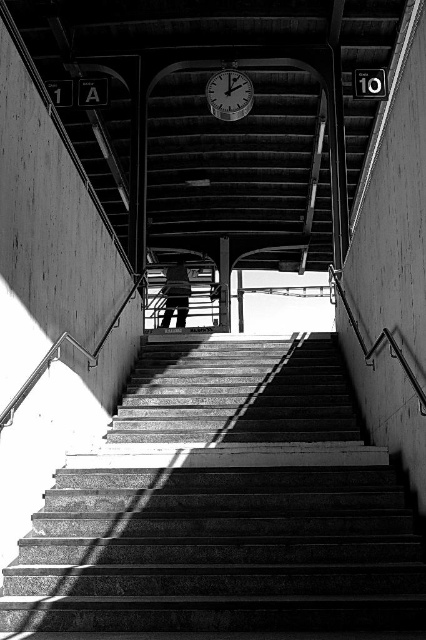
Does metallic clock at center have a lesser height compared to smooth concrete pillar at center?

Yes, metallic clock at center is shorter than smooth concrete pillar at center.

Can you confirm if metallic clock at center is positioned below smooth concrete pillar at center?

No.

Between point (230, 72) and point (227, 272), which one is positioned behind?

Point (227, 272)

The width and height of the screenshot is (426, 640). I want to click on metallic clock at center, so click(x=229, y=93).

Does metallic clock at center appear on the right side of metallic silver skateboard at center?

Correct, you'll find metallic clock at center to the right of metallic silver skateboard at center.

Is metallic clock at center below metallic silver skateboard at center?

Incorrect, metallic clock at center is not positioned below metallic silver skateboard at center.

The image size is (426, 640). Describe the element at coordinates (229, 93) in the screenshot. I see `metallic clock at center` at that location.

The image size is (426, 640). Identify the location of metallic clock at center. (229, 93).

Which is below, concrete stairs at center or smooth concrete pillar at center?

concrete stairs at center

Is point (149, 596) less distant than point (230, 307)?

Yes, it is in front of point (230, 307).

Is point (193, 353) more distant than point (224, 298)?

No, it is not.

This screenshot has width=426, height=640. I want to click on concrete stairs at center, so click(x=224, y=509).